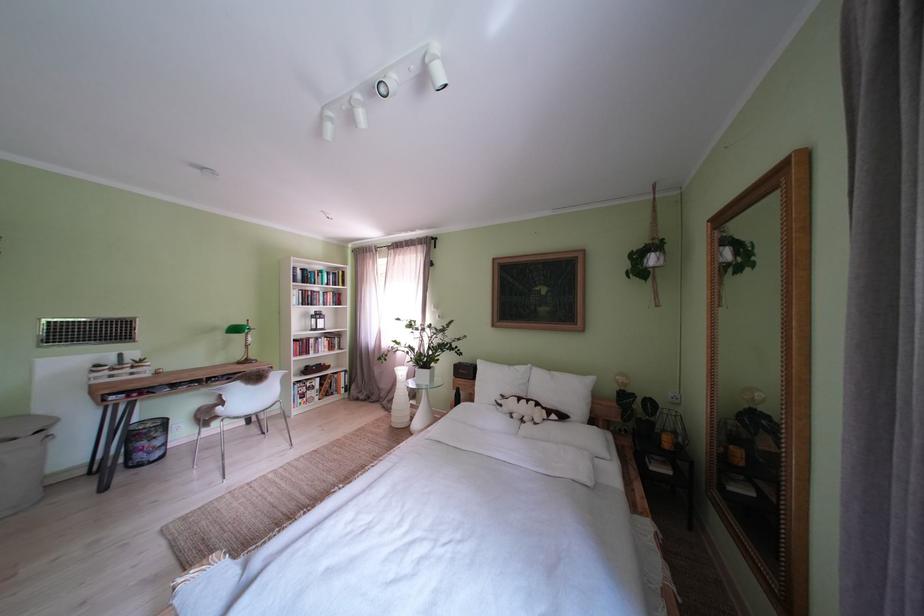
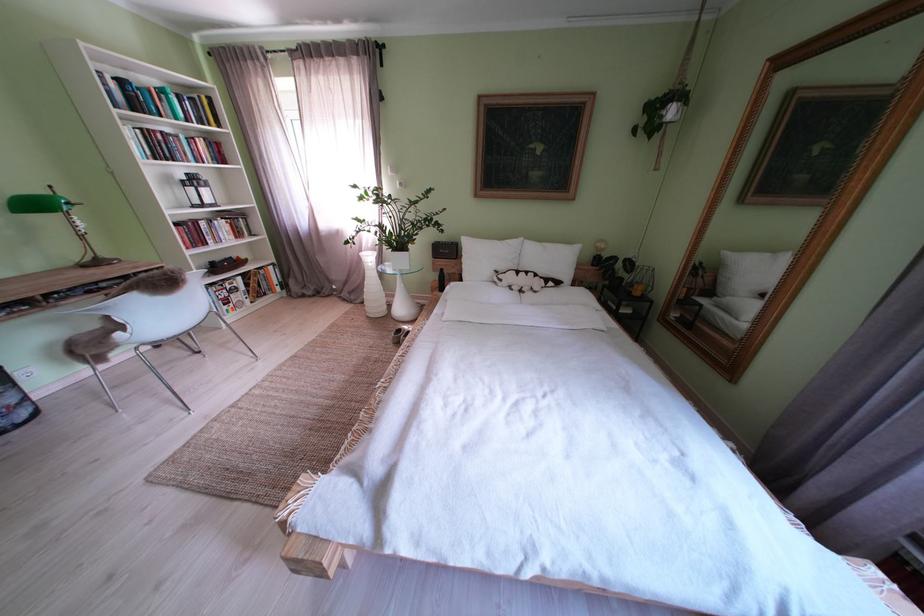
Locate, in the second image, the point that corresponds to [400,411] in the first image.

(363, 302)